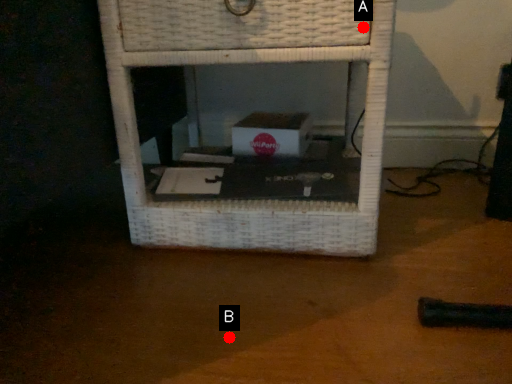
Question: Two points are circled on the image, labeled by A and B beside each circle. Among these points, which one is nearest to the camera?

Choices:
 (A) A is closer
 (B) B is closer

Answer: (B)